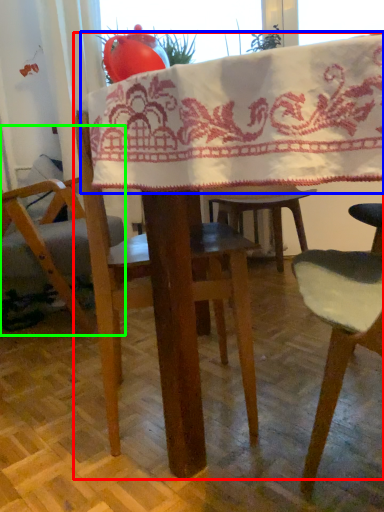
Question: Which is nearer to the table (highlighted by a red box)? blanket (highlighted by a blue box) or chair (highlighted by a green box).

Choices:
 (A) blanket
 (B) chair

Answer: (A)